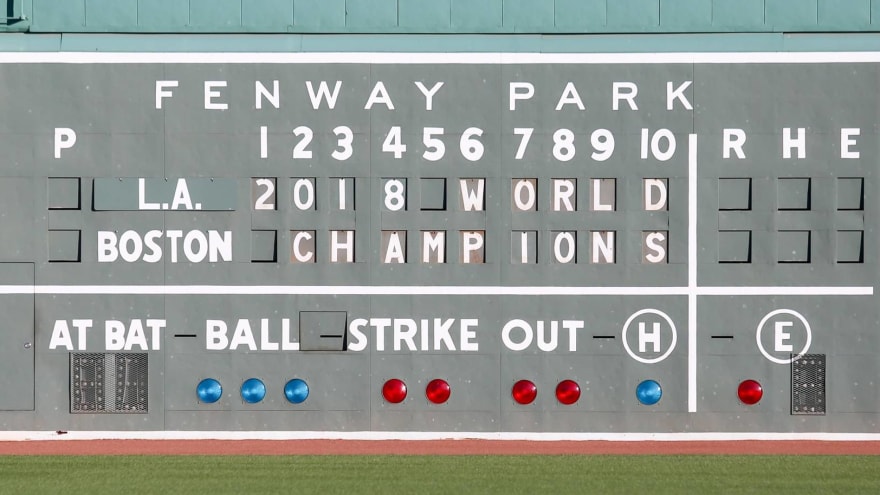
This screenshot has height=495, width=880. I want to click on red circle light, so click(x=394, y=393), click(x=437, y=391), click(x=526, y=396), click(x=568, y=397), click(x=749, y=396).